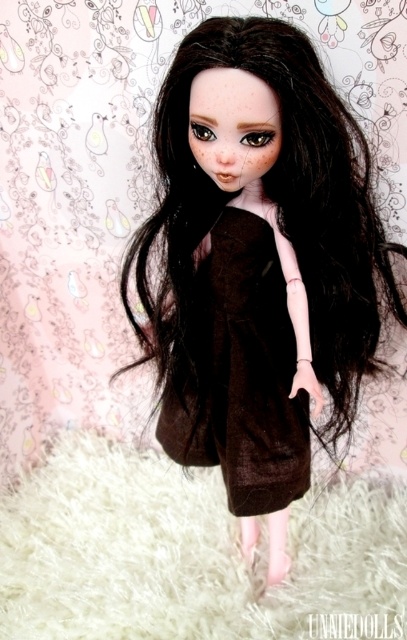
Between black silky hair at center and brown matte dress at center, which one appears on the right side from the viewer's perspective?

From the viewer's perspective, black silky hair at center appears more on the right side.

Is black silky hair at center further to camera compared to brown matte dress at center?

No, it is not.

You are a GUI agent. You are given a task and a screenshot of the screen. Output one action in this format:
    pyautogui.click(x=<x>, y=<y>)
    Task: Click on the black silky hair at center
    
    Given the screenshot: What is the action you would take?
    pyautogui.click(x=256, y=259)

What are the coordinates of `black silky hair at center` in the screenshot? It's located at point(256,259).